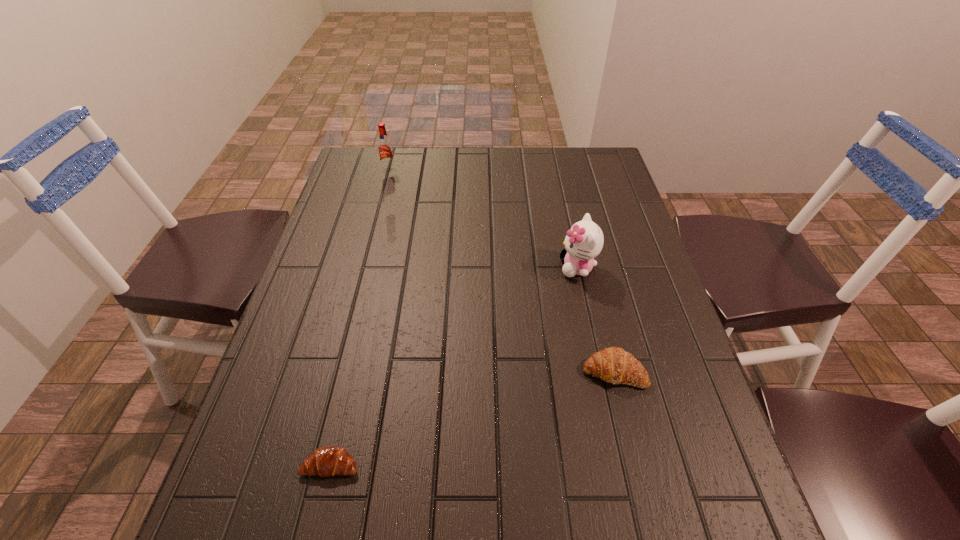
Where is `vacant space at the right edge`? The image size is (960, 540). vacant space at the right edge is located at coordinates (605, 226).

This screenshot has height=540, width=960. In the image, there is a desktop. In order to click on free space at the far left corner in this screenshot , I will do `click(357, 167)`.

The height and width of the screenshot is (540, 960). What are the coordinates of `vacant space at the far right corner of the desktop` in the screenshot? It's located at 586,179.

Locate an element on the screen. The image size is (960, 540). unoccupied position between the second farthest object and the root beer is located at coordinates (483, 219).

Locate an element on the screen. free space between the farthest object and the taller crescent roll is located at coordinates (501, 271).

The image size is (960, 540). Identify the location of empty space that is in between the second nearest object and the root beer. (501, 271).

Identify the location of free space between the root beer and the second farthest object. This screenshot has width=960, height=540. (483, 219).

Find the location of a particular element. empty space between the kitten and the farthest object is located at coordinates (483, 219).

Locate an element on the screen. free space between the farther crescent roll and the root beer is located at coordinates (501, 271).

In order to click on empty space that is in between the right crescent roll and the nearer crescent roll in this screenshot , I will do `click(472, 418)`.